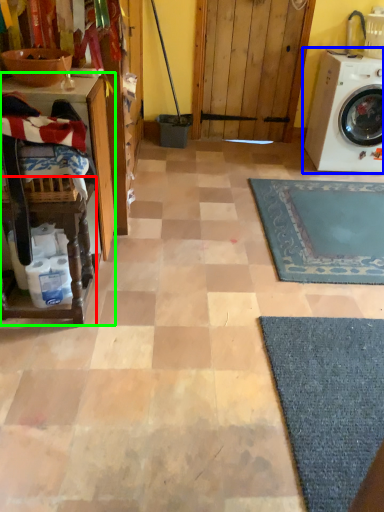
Question: Based on their relative distances, which object is nearer to table (highlighted by a red box)? Choose from washing machine (highlighted by a blue box) and table (highlighted by a green box).

Choices:
 (A) washing machine
 (B) table

Answer: (B)